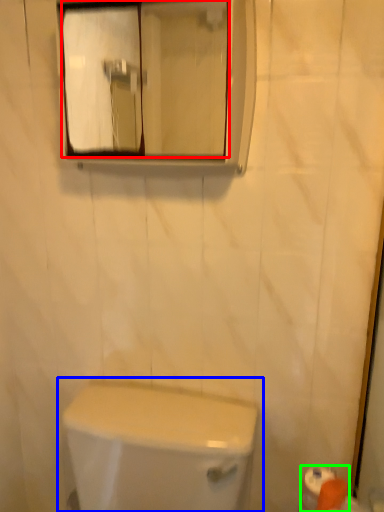
Question: Which object is the closest to the mirror (highlighted by a red box)? Choose among these: toilet (highlighted by a blue box) or toilet paper (highlighted by a green box).

Choices:
 (A) toilet
 (B) toilet paper

Answer: (A)